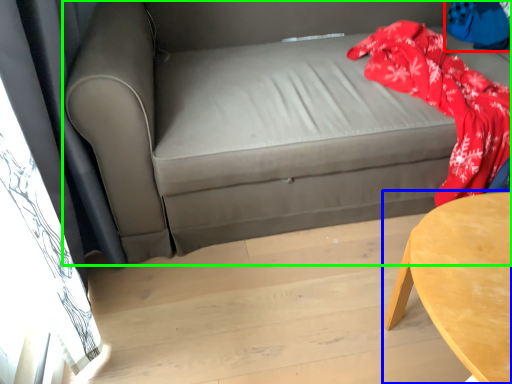
Question: Estimate the real-world distances between objects in this image. Which object is closer to clothing (highlighted by a red box), table (highlighted by a blue box) or studio couch (highlighted by a green box)?

Choices:
 (A) table
 (B) studio couch

Answer: (B)